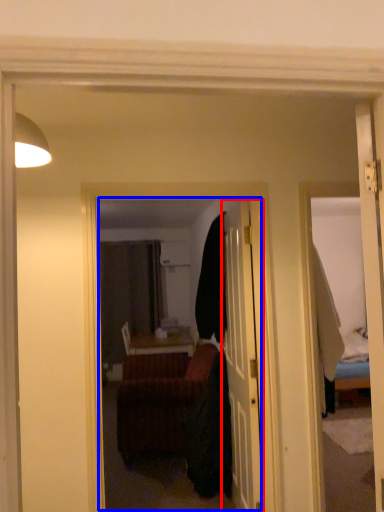
Question: Among these objects, which one is nearest to the camera, door (highlighted by a red box) or mirror (highlighted by a blue box)?

Choices:
 (A) door
 (B) mirror

Answer: (B)